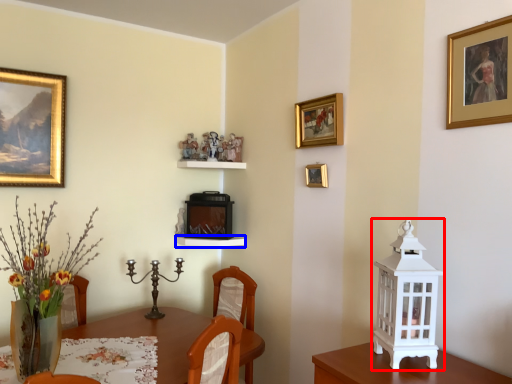
Question: Which object appears closest to the camera in this image, candle holder (highlighted by a red box) or shelf (highlighted by a blue box)?

Choices:
 (A) candle holder
 (B) shelf

Answer: (A)